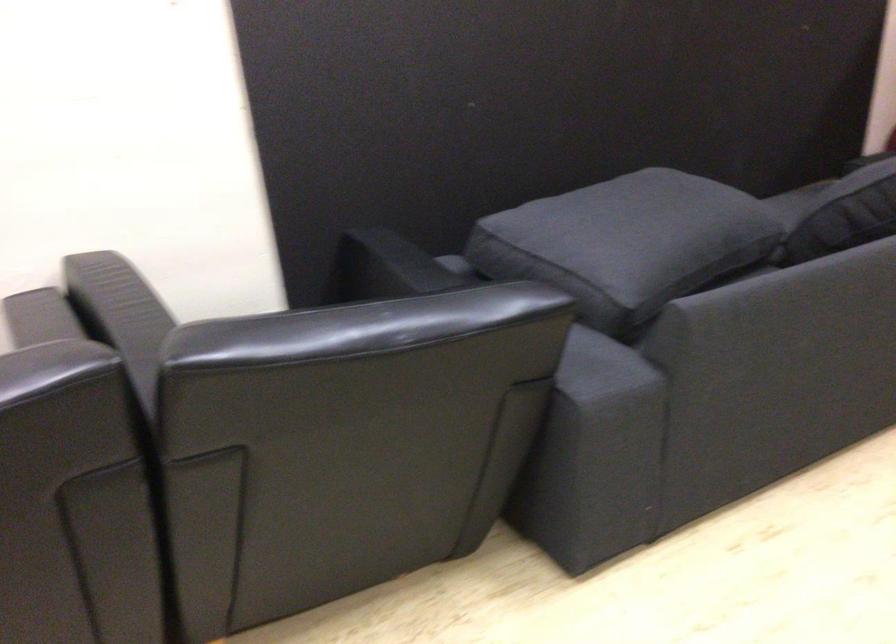
The height and width of the screenshot is (644, 896). Find the location of `sofa armrest`. sofa armrest is located at coordinates (117, 307).